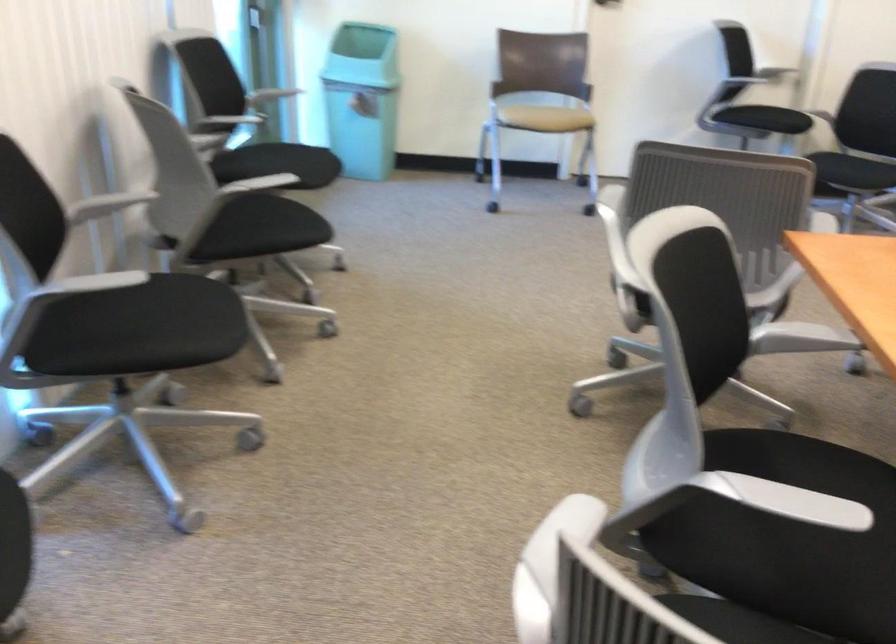
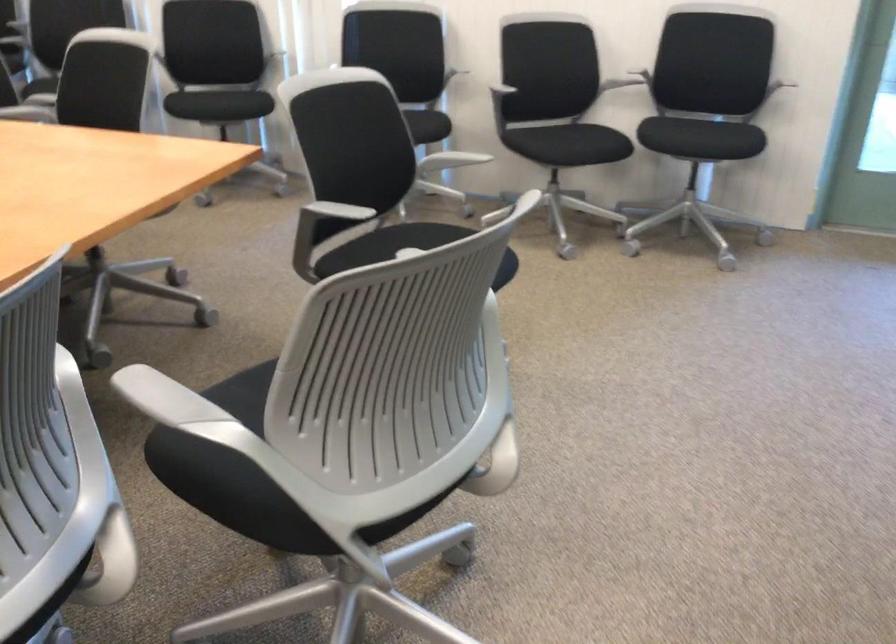
Locate, in the second image, the point that corresponds to pixel 312 175 in the first image.

(701, 138)